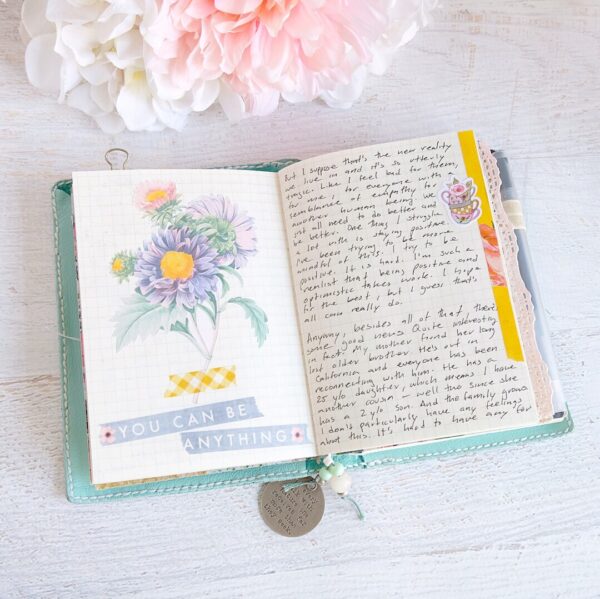
The image size is (600, 599). What are the coordinates of `stack teacups sticker` in the screenshot? It's located at (463, 205).